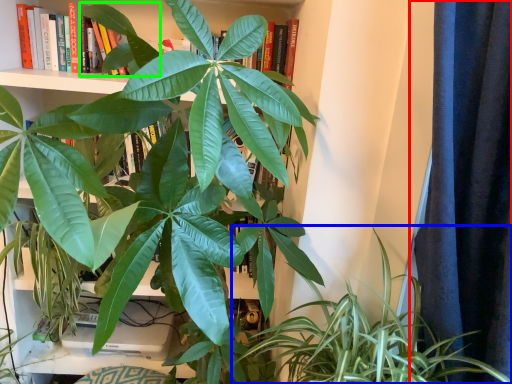
Question: Which object is positioned farthest from curtain (highlighted by a red box)? Select from houseplant (highlighted by a blue box) and leaf (highlighted by a green box).

Choices:
 (A) houseplant
 (B) leaf

Answer: (B)